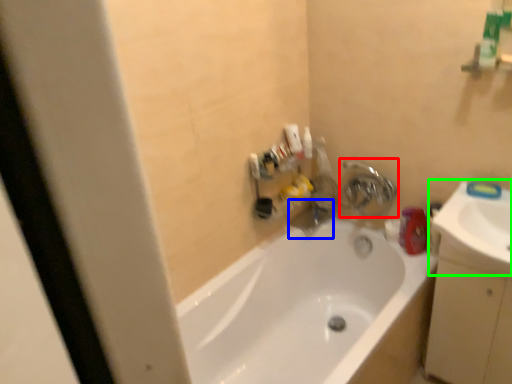
Question: Which is nearer to the tap (highlighted by a red box)? plumbing fixture (highlighted by a blue box) or sink (highlighted by a green box).

Choices:
 (A) plumbing fixture
 (B) sink

Answer: (A)